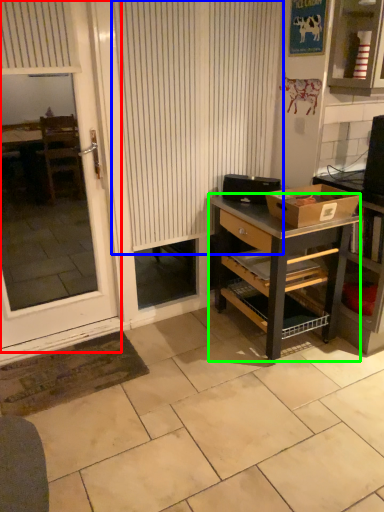
Question: Based on their relative distances, which object is nearer to screen door (highlighted by a red box)? Choose from curtain (highlighted by a blue box) and desk (highlighted by a green box).

Choices:
 (A) curtain
 (B) desk

Answer: (A)